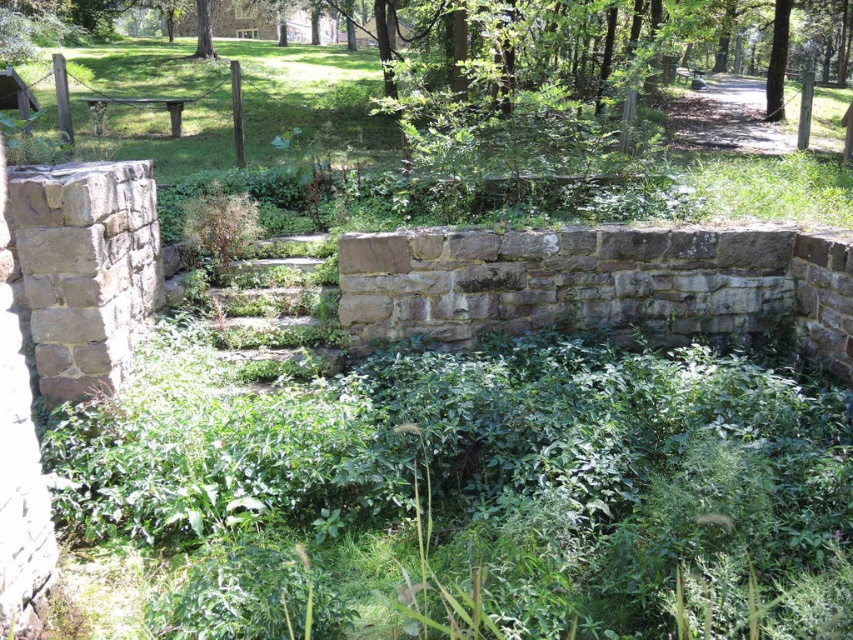
Is wooden park bench at center to the left of green leafy tree at upper center from the viewer's perspective?

No, wooden park bench at center is not to the left of green leafy tree at upper center.

I want to click on wooden park bench at center, so click(136, 104).

Who is positioned more to the right, green leafy tree at upper right or green leafy tree at upper center?

From the viewer's perspective, green leafy tree at upper right appears more on the right side.

Is green leafy tree at upper right above green leafy tree at upper center?

No, green leafy tree at upper right is not above green leafy tree at upper center.

What do you see at coordinates (776, 61) in the screenshot?
I see `green leafy tree at upper right` at bounding box center [776, 61].

Find the location of `green leafy tree at upper right`. green leafy tree at upper right is located at coordinates (776, 61).

Between green leafy tree at upper right and wooden park bench at center, which one is positioned higher?

green leafy tree at upper right is higher up.

Is point (769, 112) farther from viewer compared to point (96, 97)?

Yes, it is.

Find the location of a particular element. This screenshot has height=640, width=853. green leafy tree at upper right is located at coordinates (776, 61).